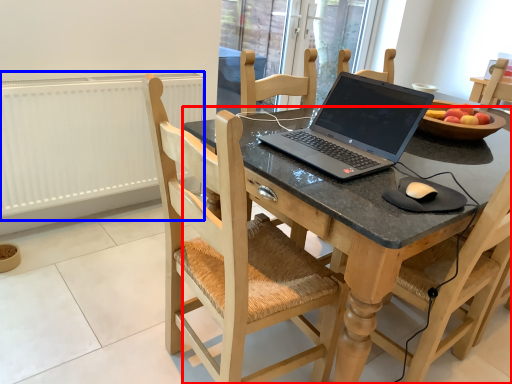
Question: Which of the following is the closest to the observer, desk (highlighted by a red box) or radiator (highlighted by a blue box)?

Choices:
 (A) desk
 (B) radiator

Answer: (A)